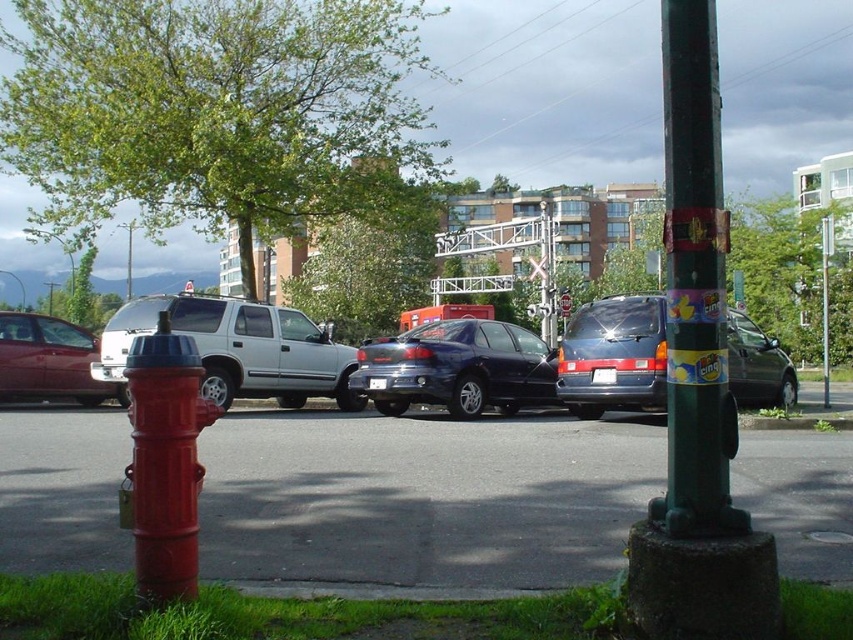
Question: Estimate the real-world distances between objects in this image. Which object is closer to the metallic red sedan at left?

Choices:
 (A) metallic silver suv at center
 (B) brushed metal fire hydrant at lower left
 (C) brushed metal lamp post at upper center

Answer: (A)

Question: Considering the relative positions of shiny red fire hydrant at lower left and matte black minivan at center in the image provided, where is shiny red fire hydrant at lower left located with respect to matte black minivan at center?

Choices:
 (A) above
 (B) below

Answer: (B)

Question: Which point appears farthest from the camera in this image?

Choices:
 (A) (610, 403)
 (B) (24, 301)

Answer: (B)

Question: Which point is closer to the camera taking this photo?

Choices:
 (A) (196, 310)
 (B) (523, 404)
 (C) (39, 324)

Answer: (A)

Question: Does shiny red fire hydrant at lower left have a smaller size compared to brushed metal lamp post at upper center?

Choices:
 (A) yes
 (B) no

Answer: (A)

Question: Does shiny black sedan at center have a larger size compared to metallic red sedan at left?

Choices:
 (A) yes
 (B) no

Answer: (A)